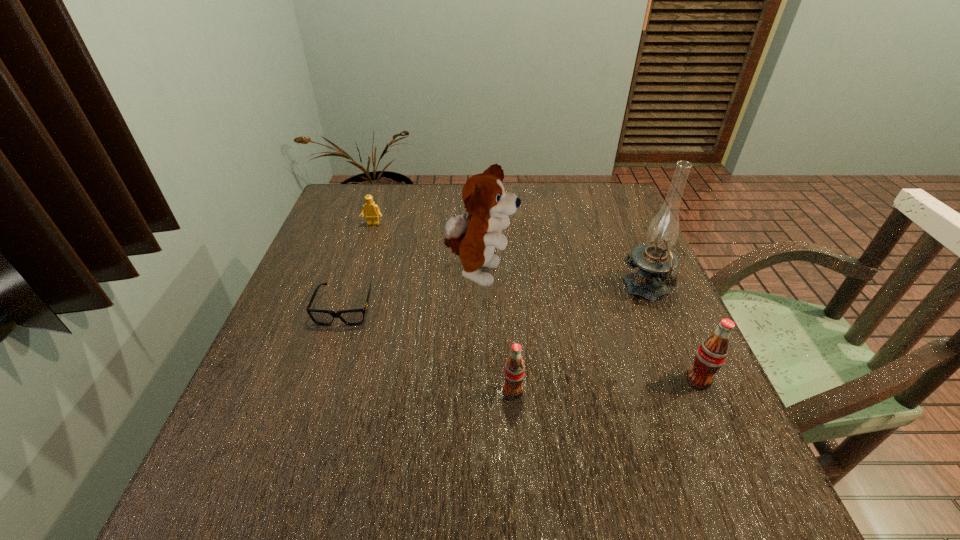
The height and width of the screenshot is (540, 960). Identify the location of the third shortest object. (514, 370).

The image size is (960, 540). I want to click on the left soda, so click(514, 370).

At what (x,y) coordinates should I click in order to perform the action: click on the taller soda. Please return your answer as a coordinate pair (x, y). Looking at the image, I should click on (711, 354).

This screenshot has height=540, width=960. Find the location of `the right soda`. the right soda is located at coordinates (711, 354).

Locate an element on the screen. The height and width of the screenshot is (540, 960). the fifth tallest object is located at coordinates (372, 212).

The height and width of the screenshot is (540, 960). Identify the location of the farthest object. (372, 212).

Image resolution: width=960 pixels, height=540 pixels. In order to click on puppy in this screenshot , I will do `click(474, 237)`.

Locate an element on the screen. Image resolution: width=960 pixels, height=540 pixels. sunglasses is located at coordinates (352, 317).

At what (x,y) coordinates should I click in order to perform the action: click on oil lamp. Please return your answer as a coordinate pair (x, y). This screenshot has height=540, width=960. Looking at the image, I should click on (657, 263).

Where is `free space located 0.370m on the right of the fourth tallest object`? The image size is (960, 540). free space located 0.370m on the right of the fourth tallest object is located at coordinates (715, 391).